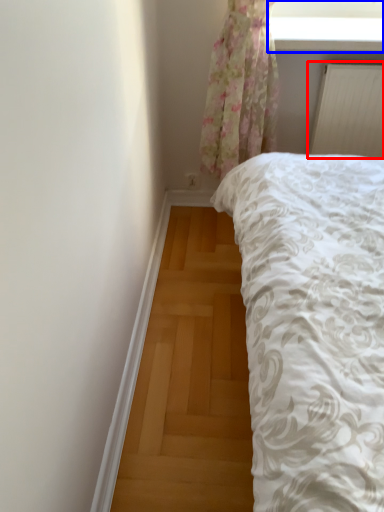
Question: Which point is further to the camera, radiator (highlighted by a red box) or window screen (highlighted by a blue box)?

Choices:
 (A) radiator
 (B) window screen

Answer: (A)